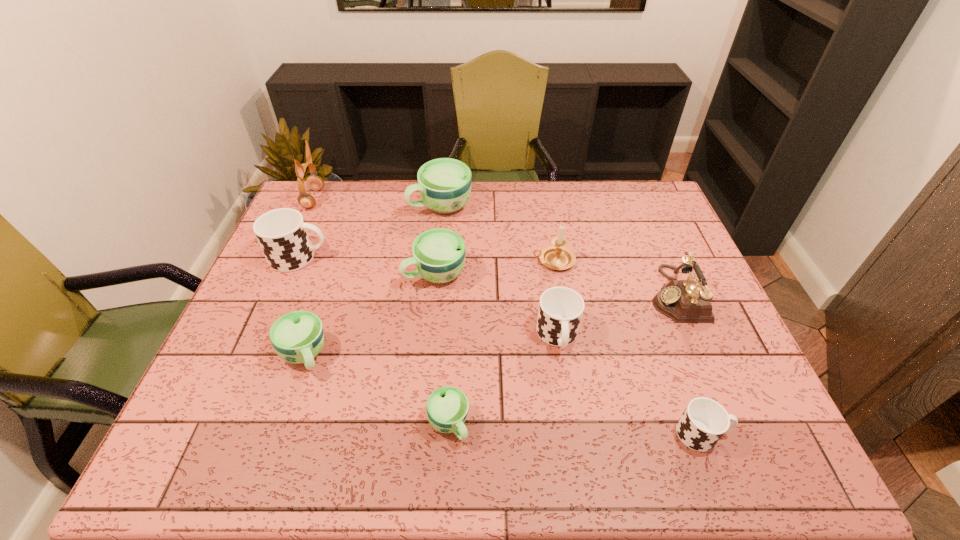
Identify the location of free location that satisfies the following two spatial constraints: 1. on the side of the leftmost black cup with the handle; 2. on the left side of the leftmost blue cup. This screenshot has width=960, height=540. (257, 355).

Identify the location of free space that satisfies the following two spatial constraints: 1. on the side of the biggest black cup with the handle; 2. on the right side of the leftmost blue cup. (257, 355).

Locate an element on the screen. free point that satisfies the following two spatial constraints: 1. on the back side of the smallest blue cup; 2. on the side of the leftmost black cup with the handle is located at coordinates (457, 258).

Identify the location of vacant space that satisfies the following two spatial constraints: 1. on the dial of the telephone; 2. on the front side of the leftmost blue cup. The image size is (960, 540). (701, 355).